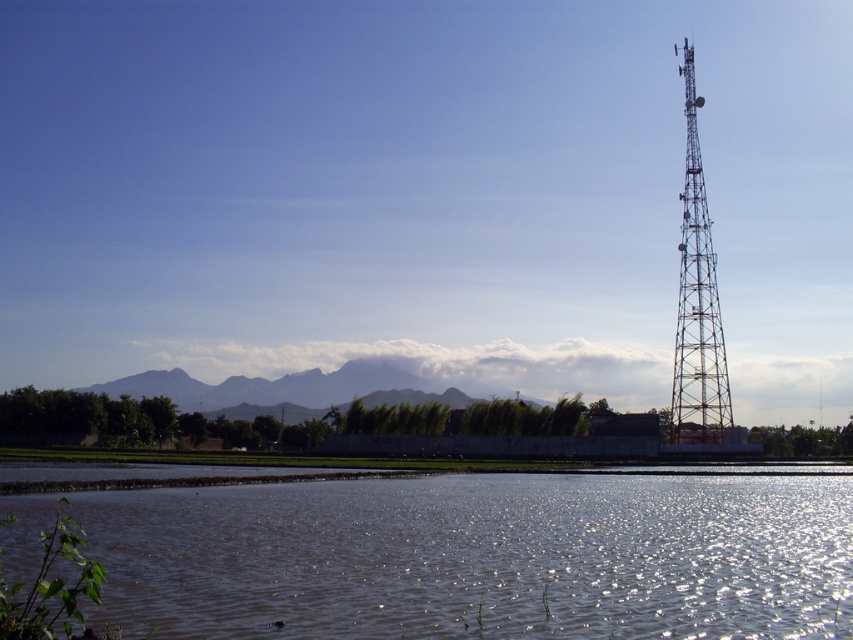
Question: Which of the following is the closest to the observer?

Choices:
 (A) (706, 314)
 (B) (302, 508)

Answer: (B)

Question: Which point is closer to the camera?

Choices:
 (A) (431, 531)
 (B) (718, 403)

Answer: (A)

Question: Can you confirm if clear water at lower center is positioned to the right of metallic tower at right?

Choices:
 (A) no
 (B) yes

Answer: (A)

Question: Which point is closer to the camera?

Choices:
 (A) 286,493
 (B) 688,99

Answer: (A)

Question: Is clear water at lower center to the left of metallic tower at right from the viewer's perspective?

Choices:
 (A) no
 (B) yes

Answer: (B)

Question: Does clear water at lower center appear over metallic tower at right?

Choices:
 (A) no
 (B) yes

Answer: (A)